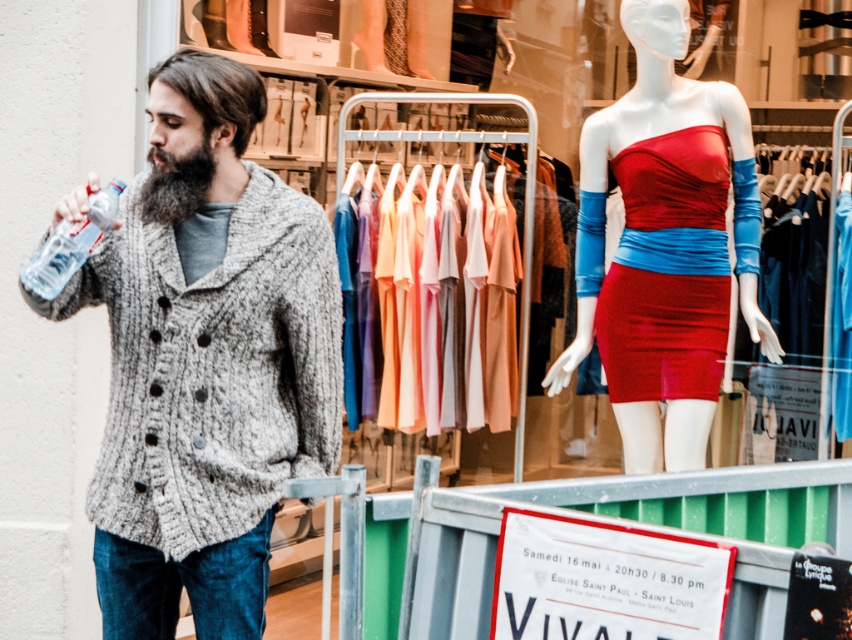
Question: Estimate the real-world distances between objects in this image. Which object is farther from the shiny red dress at center?

Choices:
 (A) knitted gray cardigan at left
 (B) clear plastic bottle at left
 (C) dark brown fuzzy beard at left
 (D) satin red dress at center

Answer: (B)

Question: Which of these objects is positioned closest to the shiny red dress at center?

Choices:
 (A) satin red dress at center
 (B) dark brown fuzzy beard at left

Answer: (A)

Question: Which point is closer to the camera?

Choices:
 (A) (649, 317)
 (B) (73, 225)
 (C) (651, 376)

Answer: (B)

Question: Is satin red dress at center bigger than dark brown fuzzy beard at left?

Choices:
 (A) yes
 (B) no

Answer: (A)

Question: Is knitted gray cardigan at left thinner than clear plastic bottle at left?

Choices:
 (A) no
 (B) yes

Answer: (A)

Question: Is shiny red dress at center positioned in front of dark brown fuzzy beard at left?

Choices:
 (A) no
 (B) yes

Answer: (A)